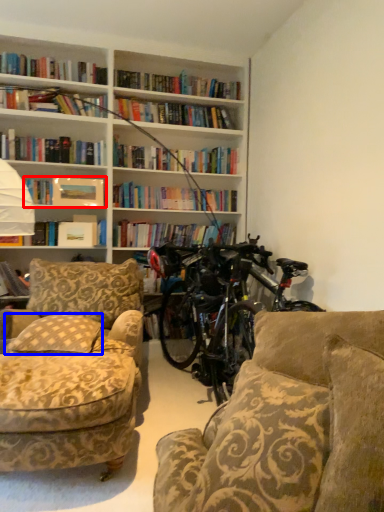
Question: Which point is further to the camera, book (highlighted by a red box) or pillow (highlighted by a blue box)?

Choices:
 (A) book
 (B) pillow

Answer: (A)